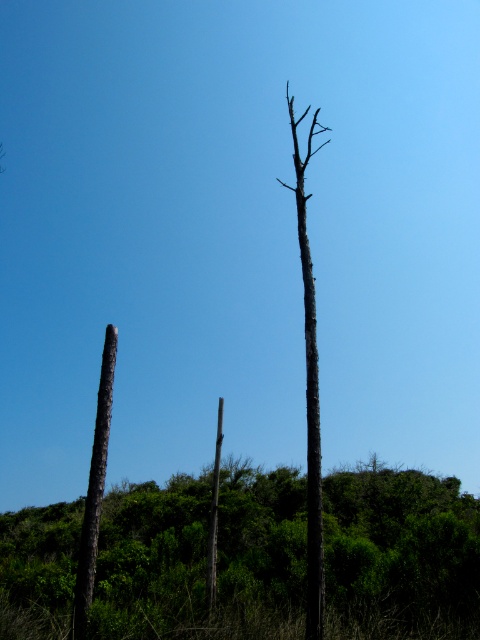
You are standing in the forest looking at the scene. You want to place a small birdhouse exactly at the point where the brown rough tree trunk at left is located. What are the coordinates of that location?

The coordinates of the brown rough tree trunk at left are at point (203, 557).

You are a hiker standing in the forest looking at the brown rough tree trunk at left and the smooth gray tree trunk at center. Which tree trunk is positioned to the east if the forest faces north?

The smooth gray tree trunk at center is positioned to the east because the brown rough tree trunk at left is to the left of it, and since the forest faces north, left would be west, making the smooth gray tree trunk at center the eastern one.

You are standing in the forest looking at the three tree trunks. There are two points marked on the ground in front of you. One is at coordinates point (344, 497) and the other at point (319, 538). Which point is closer to you?

Point (319, 538) is closer to you because it is in front of point (344, 497).